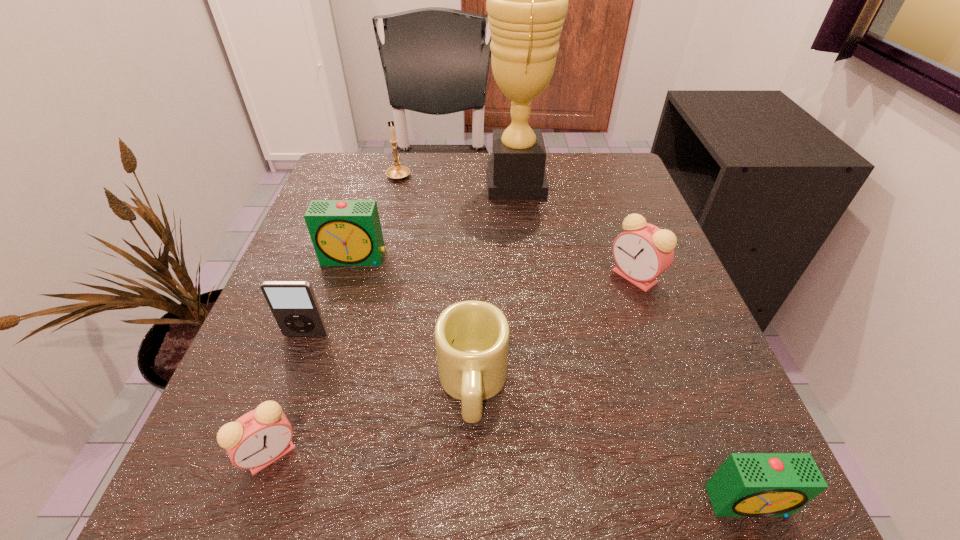
I want to click on vacant area located 0.140m on the face of the right pink alarm clock, so click(x=533, y=276).

The width and height of the screenshot is (960, 540). In order to click on free spot located 0.280m on the front-facing side of the farther green alarm clock in this screenshot , I will do `click(310, 402)`.

The image size is (960, 540). I want to click on vacant space located 0.210m on the front-facing side of the iPod, so click(257, 470).

I want to click on free point located with the handle on the side of the mug, so click(471, 478).

The width and height of the screenshot is (960, 540). What are the coordinates of `free space located 0.050m on the face of the smaller pink alarm clock` in the screenshot? It's located at (246, 525).

Locate an element on the screen. The height and width of the screenshot is (540, 960). trophy cup that is at the far edge is located at coordinates (527, 0).

Locate an element on the screen. The height and width of the screenshot is (540, 960). candle holder positioned at the far edge is located at coordinates click(x=397, y=172).

Image resolution: width=960 pixels, height=540 pixels. In order to click on candle holder that is at the left edge in this screenshot , I will do `click(397, 172)`.

This screenshot has height=540, width=960. What are the coordinates of `iPod positioned at the left edge` in the screenshot? It's located at coord(293,304).

At what (x,y) coordinates should I click in order to perform the action: click on object located in the far left corner section of the desktop. Please return your answer as a coordinate pair (x, y). The height and width of the screenshot is (540, 960). Looking at the image, I should click on (397, 172).